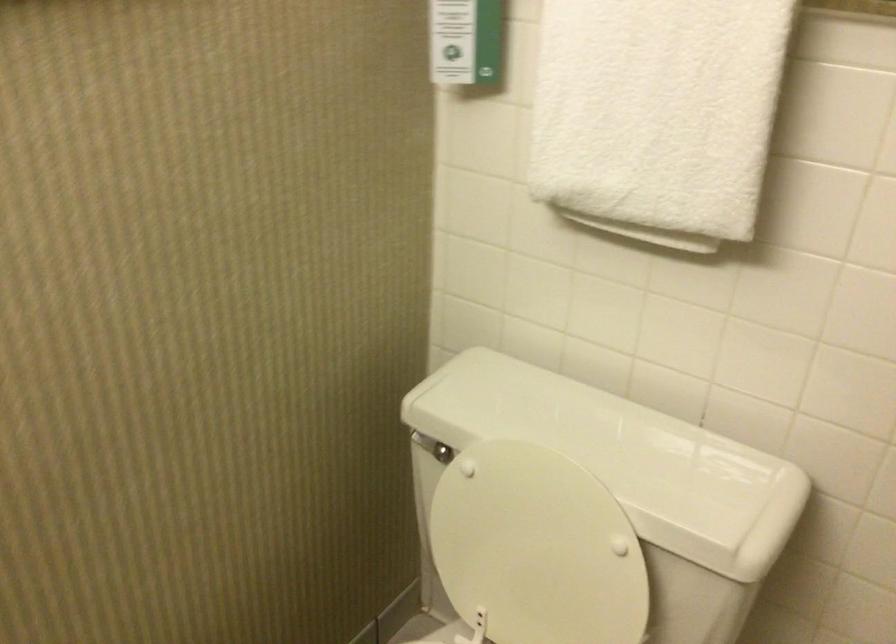
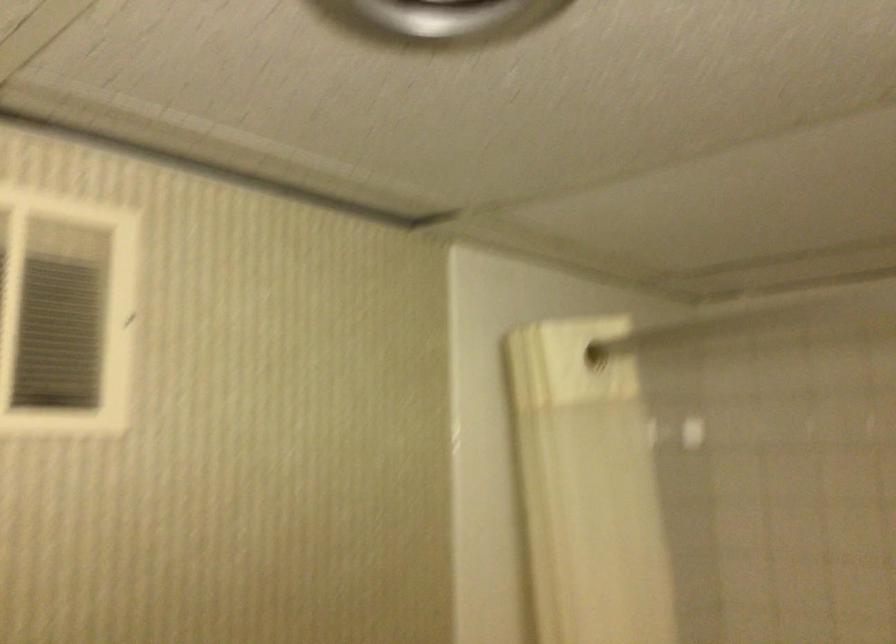
Question: The camera is either moving clockwise (left) or counter-clockwise (right) around the object. The first image is from the beginning of the video and the second image is from the end. Is the camera moving left or right when shooting the video?

Choices:
 (A) Left
 (B) Right

Answer: (A)